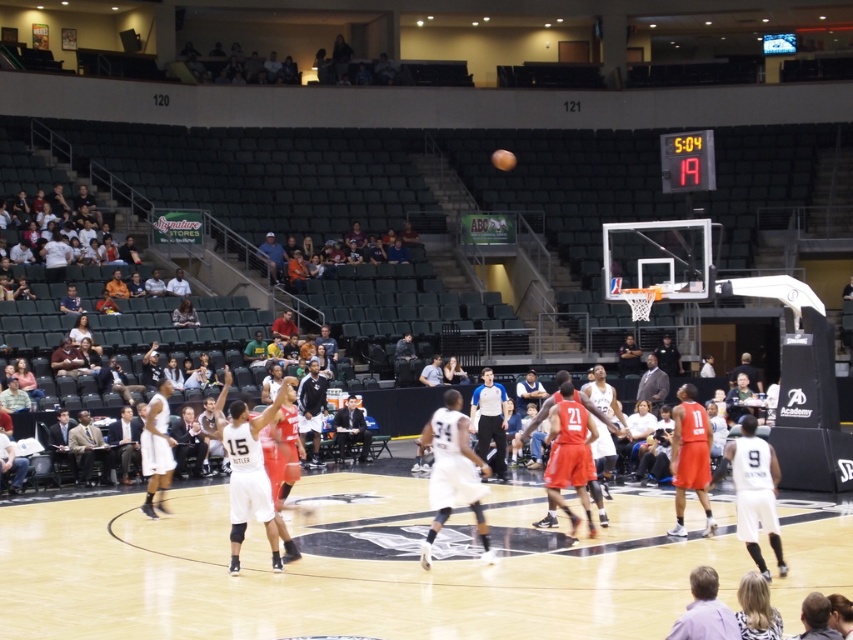
Question: Which of the following is the farthest from the observer?

Choices:
 (A) black suit at center
 (B) white matte basketball player at center
 (C) black jersey at center

Answer: (A)

Question: Is white matte basketball player at center to the left of black jersey at center from the viewer's perspective?

Choices:
 (A) no
 (B) yes

Answer: (A)

Question: Which object appears farthest from the camera in this image?

Choices:
 (A) black jersey at center
 (B) shiny orange basketball at center
 (C) black suit at center
 (D) light blue fabric shirt at center

Answer: (D)

Question: Considering the relative positions of white matte basketball player at center and dark gray suit at center in the image provided, where is white matte basketball player at center located with respect to dark gray suit at center?

Choices:
 (A) above
 (B) below

Answer: (B)

Question: Which point appears farthest from the camera in this image?

Choices:
 (A) (264, 256)
 (B) (509, 164)

Answer: (A)

Question: Can you confirm if white matte basketball player at center is bigger than dark gray suit at center?

Choices:
 (A) yes
 (B) no

Answer: (B)